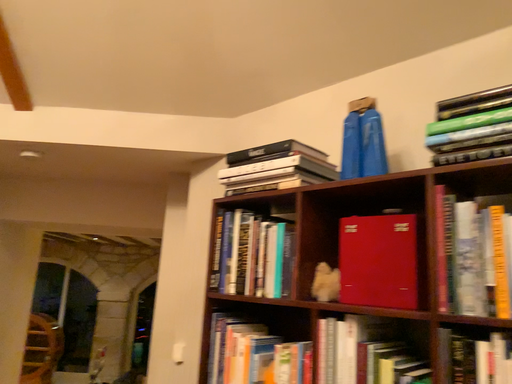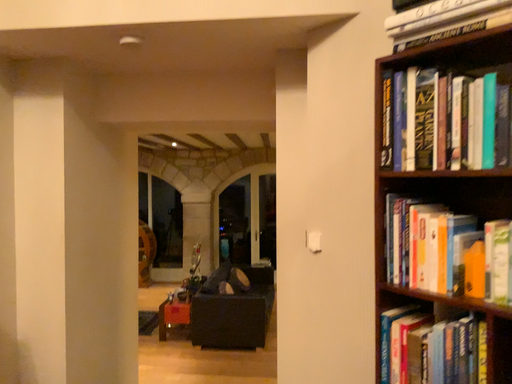
Question: How did the camera likely rotate when shooting the video?

Choices:
 (A) rotated downward
 (B) rotated upward

Answer: (A)